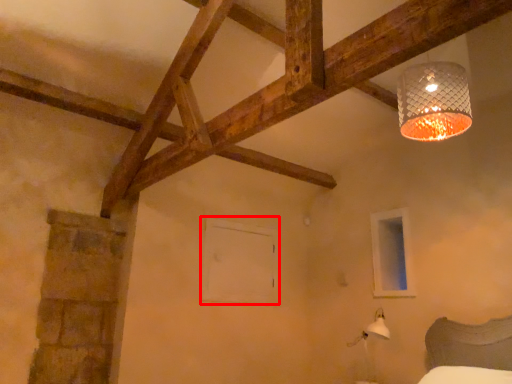
Question: In this image, where is window frame (annotated by the red box) located relative to window frame?

Choices:
 (A) right
 (B) left

Answer: (B)